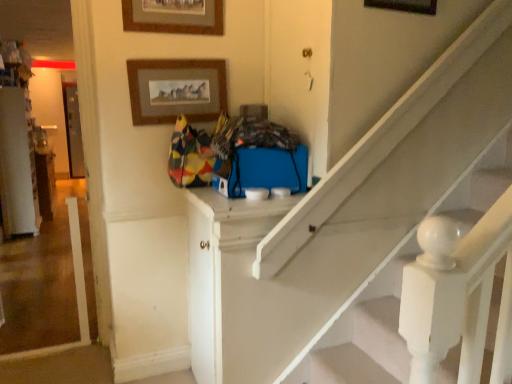
Question: Considering the relative positions of wooden picture frame at upper center, the 3th picture frame when ordered from right to left, and wooden picture frame at upper center, the third picture frame in the left-to-right sequence, in the image provided, is wooden picture frame at upper center, the 3th picture frame when ordered from right to left, in front of wooden picture frame at upper center, the third picture frame in the left-to-right sequence,?

Choices:
 (A) yes
 (B) no

Answer: (B)

Question: Considering the relative sizes of wooden picture frame at upper center, which is counted as the 1th picture frame, starting from the left, and wooden picture frame at upper center, the third picture frame in the left-to-right sequence, in the image provided, is wooden picture frame at upper center, which is counted as the 1th picture frame, starting from the left, bigger than wooden picture frame at upper center, the third picture frame in the left-to-right sequence,?

Choices:
 (A) yes
 (B) no

Answer: (A)

Question: Would you say wooden picture frame at upper center, the 3th picture frame when ordered from right to left, contains wooden picture frame at upper center, which is the first picture frame in right-to-left order?

Choices:
 (A) no
 (B) yes

Answer: (A)

Question: Considering the relative sizes of wooden picture frame at upper center, the 3th picture frame when ordered from right to left, and wooden picture frame at upper center, which is the first picture frame in right-to-left order, in the image provided, is wooden picture frame at upper center, the 3th picture frame when ordered from right to left, thinner than wooden picture frame at upper center, which is the first picture frame in right-to-left order,?

Choices:
 (A) yes
 (B) no

Answer: (B)

Question: From the image's perspective, is wooden picture frame at upper center, the 3th picture frame when ordered from right to left, located above wooden picture frame at upper center, which is the first picture frame in right-to-left order?

Choices:
 (A) no
 (B) yes

Answer: (A)

Question: Considering the relative sizes of wooden picture frame at upper center, the 3th picture frame when ordered from right to left, and wooden picture frame at upper center, which is the first picture frame in right-to-left order, in the image provided, is wooden picture frame at upper center, the 3th picture frame when ordered from right to left, wider than wooden picture frame at upper center, which is the first picture frame in right-to-left order,?

Choices:
 (A) no
 (B) yes

Answer: (B)

Question: Is wooden picture frame at upper center, which is the first picture frame in right-to-left order, to the right of white painted wood door at center, the 1th door from the left, from the viewer's perspective?

Choices:
 (A) no
 (B) yes

Answer: (B)

Question: From a real-world perspective, is wooden picture frame at upper center, the third picture frame in the left-to-right sequence, under white painted wood door at center, the first door in the bottom-to-top sequence?

Choices:
 (A) no
 (B) yes

Answer: (A)

Question: Does wooden picture frame at upper center, the third picture frame in the left-to-right sequence, turn towards white painted wood door at center, placed as the second door when sorted from right to left?

Choices:
 (A) yes
 (B) no

Answer: (B)

Question: Can you confirm if wooden picture frame at upper center, the third picture frame in the left-to-right sequence, is taller than white painted wood door at center, placed as the second door when sorted from right to left?

Choices:
 (A) yes
 (B) no

Answer: (B)

Question: Could white painted wood door at center, which is counted as the second door, starting from the top, be considered to be inside wooden picture frame at upper center, the third picture frame in the left-to-right sequence?

Choices:
 (A) yes
 (B) no

Answer: (B)

Question: From the image's perspective, is wooden picture frame at upper center, which is the first picture frame in right-to-left order, beneath white painted wood door at center, placed as the second door when sorted from right to left?

Choices:
 (A) no
 (B) yes

Answer: (A)

Question: Can you confirm if wooden picture frame at upper center, the 3th picture frame when ordered from right to left, is shorter than white painted wood door at center, the 1th door from the left?

Choices:
 (A) yes
 (B) no

Answer: (A)